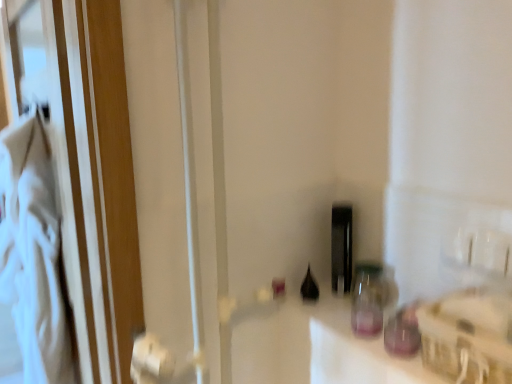
Question: Does black glass bottle at center, which is the 4th bottle in front-to-back order, turn towards transparent glass bottle at center, which is the 4th bottle from back to front?

Choices:
 (A) no
 (B) yes

Answer: (A)

Question: Does black glass bottle at center, which ranks as the first bottle in back-to-front order, lie behind transparent glass bottle at center, which is the 4th bottle from back to front?

Choices:
 (A) no
 (B) yes

Answer: (B)

Question: Is black glass bottle at center, which is the 4th bottle in front-to-back order, looking in the opposite direction of transparent glass bottle at center, which is the 4th bottle from back to front?

Choices:
 (A) yes
 (B) no

Answer: (B)

Question: From a real-world perspective, is black glass bottle at center, which ranks as the first bottle in back-to-front order, on top of transparent glass bottle at center, which is the 4th bottle from back to front?

Choices:
 (A) yes
 (B) no

Answer: (A)

Question: Is black glass bottle at center, which is the 4th bottle in front-to-back order, completely or partially outside of transparent glass bottle at center, which is the 4th bottle from back to front?

Choices:
 (A) no
 (B) yes

Answer: (B)

Question: Is black glass bottle at center, which ranks as the first bottle in back-to-front order, to the left of transparent glass bottle at center, which is the 4th bottle from back to front, from the viewer's perspective?

Choices:
 (A) yes
 (B) no

Answer: (A)

Question: Is transparent glass bottle at center, the first bottle from the front, at the right side of black glass bottle at center, the 3th bottle from the front?

Choices:
 (A) no
 (B) yes

Answer: (B)

Question: Is transparent glass bottle at center, the first bottle from the front, aimed at black glass bottle at center, the 2th bottle positioned from the back?

Choices:
 (A) no
 (B) yes

Answer: (A)

Question: Is transparent glass bottle at center, which is the 4th bottle from back to front, shorter than black glass bottle at center, the 3th bottle from the front?

Choices:
 (A) yes
 (B) no

Answer: (A)

Question: Does transparent glass bottle at center, which is the 4th bottle from back to front, have a larger size compared to black glass bottle at center, the 3th bottle from the front?

Choices:
 (A) yes
 (B) no

Answer: (A)

Question: From the image's perspective, is transparent glass bottle at center, which is the 4th bottle from back to front, beneath black glass bottle at center, the 3th bottle from the front?

Choices:
 (A) no
 (B) yes

Answer: (B)

Question: Can you confirm if transparent glass bottle at center, which is the 4th bottle from back to front, is thinner than black glass bottle at center, the 3th bottle from the front?

Choices:
 (A) no
 (B) yes

Answer: (A)

Question: Can you confirm if transparent glass jar at center-right, acting as the third bottle starting from the back, is wider than black glass bottle at center, the 3th bottle from the front?

Choices:
 (A) no
 (B) yes

Answer: (B)